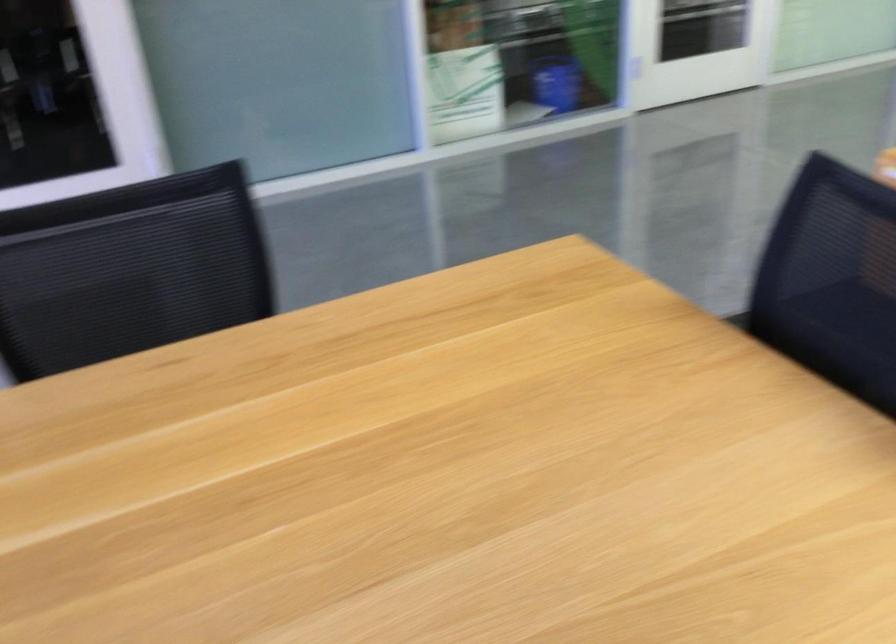
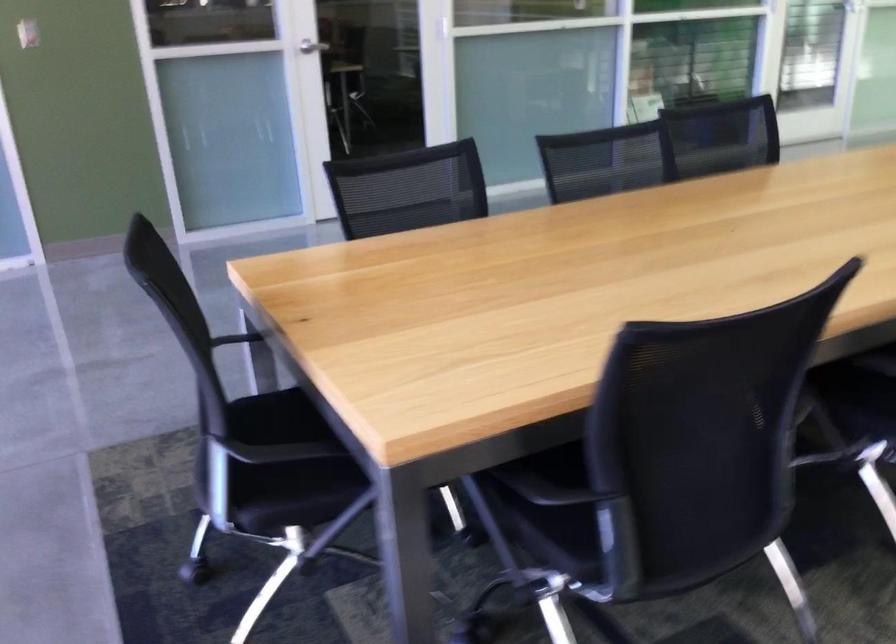
Which direction would the cameraman need to move to produce the second image?

The movement direction of the cameraman is left, backward.